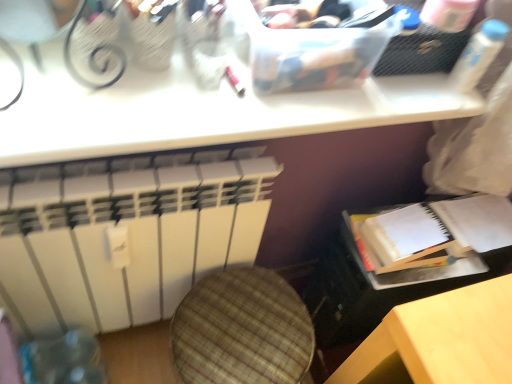
Where is `free point to the left of white plastic bottle at upper right`? free point to the left of white plastic bottle at upper right is located at coordinates (400, 91).